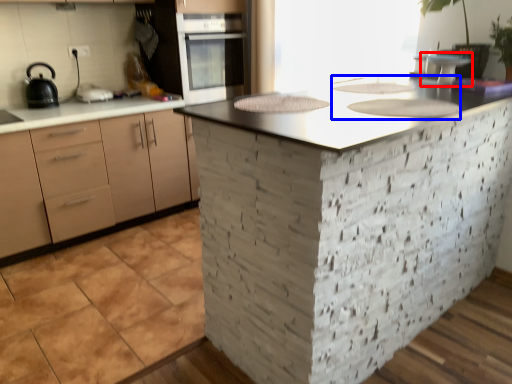
Question: Which object appears closest to the camera in this image, appliance (highlighted by a red box) or sink (highlighted by a blue box)?

Choices:
 (A) appliance
 (B) sink

Answer: (B)